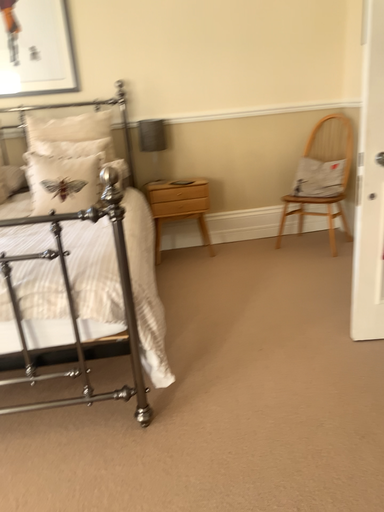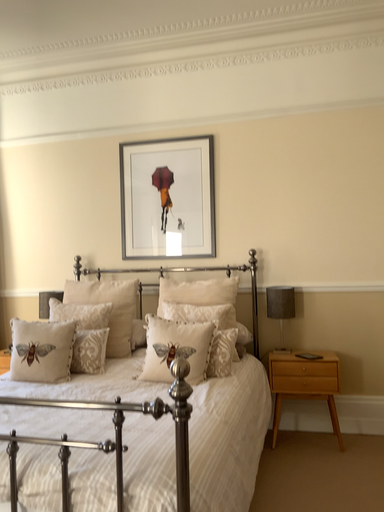
Question: Which way did the camera rotate in the video?

Choices:
 (A) rotated left
 (B) rotated right

Answer: (A)